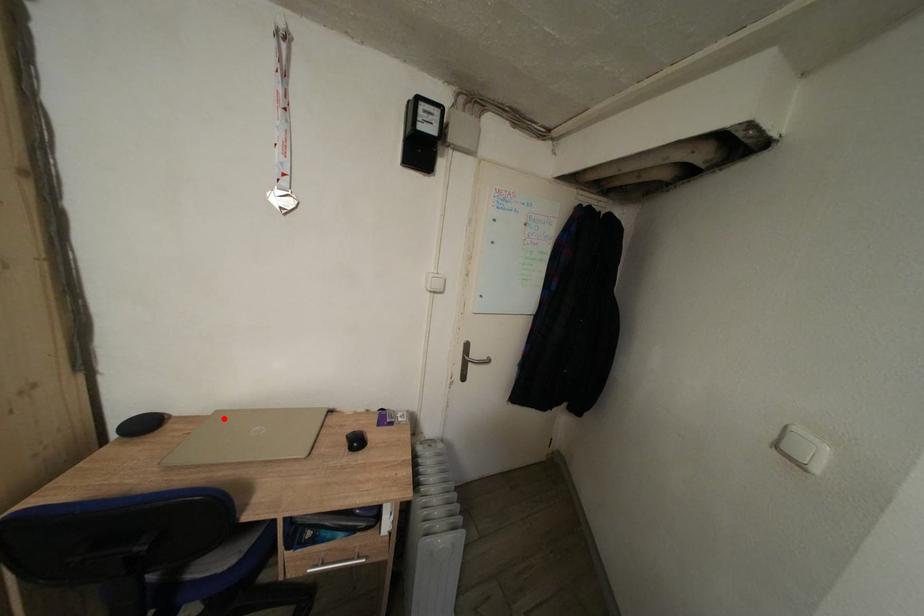
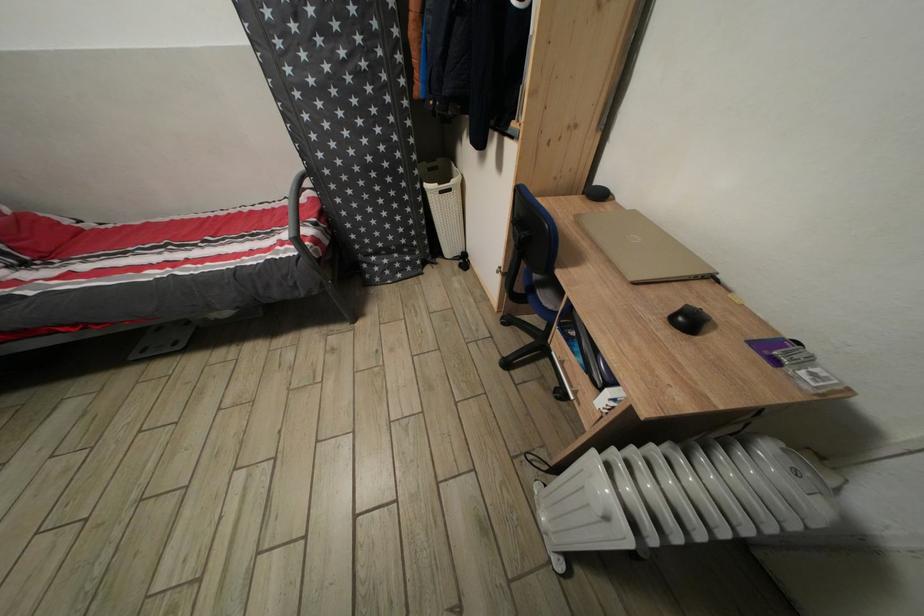
Where in the second image is the point corresponding to the highlighted location from the first image?

(641, 217)